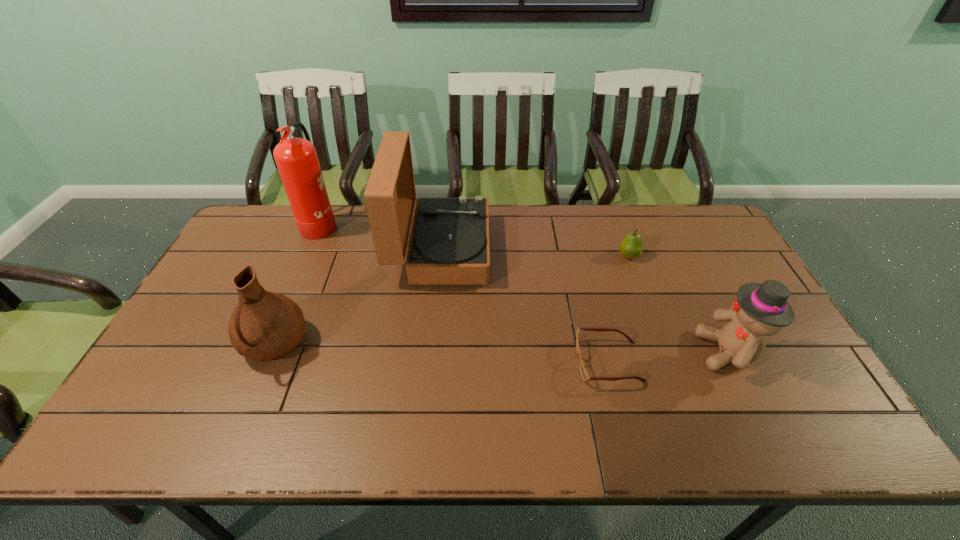
I want to click on empty space between the second tallest object and the shortest object, so click(524, 306).

The width and height of the screenshot is (960, 540). Identify the location of vacant area between the pear and the pitcher. (452, 300).

Image resolution: width=960 pixels, height=540 pixels. I want to click on blank region between the fire extinguisher and the pitcher, so click(x=298, y=283).

Identify the location of vacant space in between the second object from right to left and the second tallest object. Image resolution: width=960 pixels, height=540 pixels. (535, 253).

What are the coordinates of `free space between the pitcher and the spectacles` in the screenshot? It's located at click(442, 353).

You are a GUI agent. You are given a task and a screenshot of the screen. Output one action in this format:
    pyautogui.click(x=<x>, y=<y>)
    Task: Click on the empty space between the rag_doll and the phonograph record
    The width and height of the screenshot is (960, 540).
    Given the screenshot: What is the action you would take?
    pos(585,301)

Find the location of a particular element. Image resolution: width=960 pixels, height=540 pixels. vacant space that's between the pear and the rightmost object is located at coordinates (679, 303).

Find the location of a particular element. The image size is (960, 540). object that can be found as the third closest to the spectacles is located at coordinates (631, 247).

Identify which object is the nearest to the pitcher. Please provide its 2D coordinates. Your answer should be formatted as a tuple, i.e. [(x, y)], where the tuple contains the x and y coordinates of a point satisfying the conditions above.

[(449, 244)]

Locate an element on the screen. vacant area in the image that satisfies the following two spatial constraints: 1. towards the nozzle of the second shortest object; 2. on the left side of the fire extinguisher is located at coordinates (306, 256).